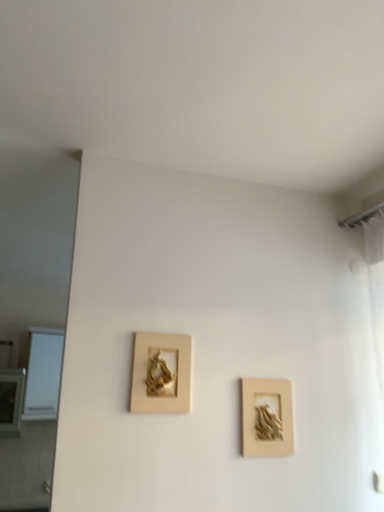
In order to click on matte gold picture frame at center, arranged as the 2th picture frame when viewed from the right in this screenshot , I will do `click(161, 374)`.

At what (x,y) coordinates should I click in order to perform the action: click on white glass window at left. Please return your answer as a coordinate pair (x, y). This screenshot has width=384, height=512. Looking at the image, I should click on (43, 374).

Where is `beige matte picture frame at center-right, which is the 2th picture frame in left-to-right order`? Image resolution: width=384 pixels, height=512 pixels. beige matte picture frame at center-right, which is the 2th picture frame in left-to-right order is located at coordinates (267, 418).

The width and height of the screenshot is (384, 512). Describe the element at coordinates (267, 418) in the screenshot. I see `beige matte picture frame at center-right, which is the 2th picture frame in left-to-right order` at that location.

The height and width of the screenshot is (512, 384). Find the location of `matte gold picture frame at center, arranged as the 2th picture frame when viewed from the right`. matte gold picture frame at center, arranged as the 2th picture frame when viewed from the right is located at coordinates (161, 374).

From a real-world perspective, is white glass window at left positioned above or below beige matte picture frame at center-right, which ranks as the 1th picture frame in right-to-left order?

From a real-world perspective, white glass window at left is physically above beige matte picture frame at center-right, which ranks as the 1th picture frame in right-to-left order.

In the scene shown: Could you measure the distance between white glass window at left and beige matte picture frame at center-right, which ranks as the 1th picture frame in right-to-left order?

white glass window at left and beige matte picture frame at center-right, which ranks as the 1th picture frame in right-to-left order, are 7.24 feet apart.

In the image, is white glass window at left on the left side or the right side of beige matte picture frame at center-right, which is the 2th picture frame in left-to-right order?

From the image, it's evident that white glass window at left is to the left of beige matte picture frame at center-right, which is the 2th picture frame in left-to-right order.

In terms of height, does white glass window at left look taller or shorter compared to beige matte picture frame at center-right, which is the 2th picture frame in left-to-right order?

Clearly, white glass window at left is taller compared to beige matte picture frame at center-right, which is the 2th picture frame in left-to-right order.

How much distance is there between matte gold picture frame at center, arranged as the 2th picture frame when viewed from the right, and beige matte picture frame at center-right, which is the 2th picture frame in left-to-right order?

A distance of 12.43 inches exists between matte gold picture frame at center, arranged as the 2th picture frame when viewed from the right, and beige matte picture frame at center-right, which is the 2th picture frame in left-to-right order.

Is beige matte picture frame at center-right, which is the 2th picture frame in left-to-right order, completely or partially inside matte gold picture frame at center, acting as the first picture frame starting from the left?

No, beige matte picture frame at center-right, which is the 2th picture frame in left-to-right order, is not inside matte gold picture frame at center, acting as the first picture frame starting from the left.

Is matte gold picture frame at center, acting as the first picture frame starting from the left, positioned with its back to beige matte picture frame at center-right, which is the 2th picture frame in left-to-right order?

That's not correct — matte gold picture frame at center, acting as the first picture frame starting from the left, is not looking away from beige matte picture frame at center-right, which is the 2th picture frame in left-to-right order.

In order to click on picture frame located below the matte gold picture frame at center, arranged as the 2th picture frame when viewed from the right (from the image's perspective) in this screenshot , I will do `click(267, 418)`.

Based on their sizes in the image, would you say beige matte picture frame at center-right, which ranks as the 1th picture frame in right-to-left order, is bigger or smaller than white glass window at left?

Clearly, beige matte picture frame at center-right, which ranks as the 1th picture frame in right-to-left order, is smaller in size than white glass window at left.

Is beige matte picture frame at center-right, which is the 2th picture frame in left-to-right order, thinner than white glass window at left?

Indeed, beige matte picture frame at center-right, which is the 2th picture frame in left-to-right order, has a lesser width compared to white glass window at left.

Between beige matte picture frame at center-right, which is the 2th picture frame in left-to-right order, and white glass window at left, which one appears on the left side from the viewer's perspective?

From the viewer's perspective, white glass window at left appears more on the left side.

From the image's perspective, is beige matte picture frame at center-right, which is the 2th picture frame in left-to-right order, above white glass window at left?

Indeed, from the image's perspective, beige matte picture frame at center-right, which is the 2th picture frame in left-to-right order, is shown above white glass window at left.

Which is nearer, (32, 412) or (182, 355)?

Point (32, 412).

Which object is positioned more to the right, white glass window at left or matte gold picture frame at center, arranged as the 2th picture frame when viewed from the right?

From the viewer's perspective, matte gold picture frame at center, arranged as the 2th picture frame when viewed from the right, appears more on the right side.

Which object is further away from the camera taking this photo, white glass window at left or matte gold picture frame at center, acting as the first picture frame starting from the left?

Positioned behind is white glass window at left.

Is white glass window at left completely or partially outside of matte gold picture frame at center, acting as the first picture frame starting from the left?

That's correct, white glass window at left is outside of matte gold picture frame at center, acting as the first picture frame starting from the left.

From the image's perspective, between beige matte picture frame at center-right, which is the 2th picture frame in left-to-right order, and matte gold picture frame at center, acting as the first picture frame starting from the left, who is located below?

beige matte picture frame at center-right, which is the 2th picture frame in left-to-right order, is shown below in the image.

Consider the image. Is matte gold picture frame at center, acting as the first picture frame starting from the left, at the back of beige matte picture frame at center-right, which is the 2th picture frame in left-to-right order?

No.

From the picture: Considering the relative sizes of beige matte picture frame at center-right, which is the 2th picture frame in left-to-right order, and matte gold picture frame at center, acting as the first picture frame starting from the left, in the image provided, is beige matte picture frame at center-right, which is the 2th picture frame in left-to-right order, wider than matte gold picture frame at center, acting as the first picture frame starting from the left,?

No.

Is point (260, 399) in front of point (161, 412)?

That is False.

Is matte gold picture frame at center, acting as the first picture frame starting from the left, bigger or smaller than white glass window at left?

Considering their sizes, matte gold picture frame at center, acting as the first picture frame starting from the left, takes up less space than white glass window at left.

Is matte gold picture frame at center, arranged as the 2th picture frame when viewed from the right, touching white glass window at left?

They are not placed beside each other.

Does point (191, 368) appear closer or farther from the camera than point (42, 389)?

Point (191, 368).

Find the location of `window on the left of beige matte picture frame at center-right, which ranks as the 1th picture frame in right-to-left order`. window on the left of beige matte picture frame at center-right, which ranks as the 1th picture frame in right-to-left order is located at coordinates (43, 374).

Find the location of a particular element. picture frame positioned vertically above the beige matte picture frame at center-right, which ranks as the 1th picture frame in right-to-left order (from a real-world perspective) is located at coordinates (x=161, y=374).

Which object lies further to the anchor point matte gold picture frame at center, acting as the first picture frame starting from the left, beige matte picture frame at center-right, which is the 2th picture frame in left-to-right order, or white glass window at left?

Among the two, white glass window at left is located further to matte gold picture frame at center, acting as the first picture frame starting from the left.

From the image, which object appears to be farther from beige matte picture frame at center-right, which is the 2th picture frame in left-to-right order, white glass window at left or matte gold picture frame at center, acting as the first picture frame starting from the left?

Among the two, white glass window at left is located further to beige matte picture frame at center-right, which is the 2th picture frame in left-to-right order.

Based on their spatial positions, is matte gold picture frame at center, arranged as the 2th picture frame when viewed from the right, or white glass window at left closer to beige matte picture frame at center-right, which ranks as the 1th picture frame in right-to-left order?

matte gold picture frame at center, arranged as the 2th picture frame when viewed from the right, lies closer to beige matte picture frame at center-right, which ranks as the 1th picture frame in right-to-left order, than the other object.

Estimate the real-world distances between objects in this image. Which object is further from matte gold picture frame at center, acting as the first picture frame starting from the left, white glass window at left or beige matte picture frame at center-right, which is the 2th picture frame in left-to-right order?

Among the two, white glass window at left is located further to matte gold picture frame at center, acting as the first picture frame starting from the left.

When comparing their distances from white glass window at left, does beige matte picture frame at center-right, which is the 2th picture frame in left-to-right order, or matte gold picture frame at center, arranged as the 2th picture frame when viewed from the right, seem closer?

matte gold picture frame at center, arranged as the 2th picture frame when viewed from the right, lies closer to white glass window at left than the other object.

Based on their spatial positions, is matte gold picture frame at center, acting as the first picture frame starting from the left, or beige matte picture frame at center-right, which ranks as the 1th picture frame in right-to-left order, further from white glass window at left?

beige matte picture frame at center-right, which ranks as the 1th picture frame in right-to-left order, lies further to white glass window at left than the other object.

Locate an element on the screen. The width and height of the screenshot is (384, 512). picture frame between matte gold picture frame at center, acting as the first picture frame starting from the left, and white glass window at left in the front-back direction is located at coordinates (267, 418).